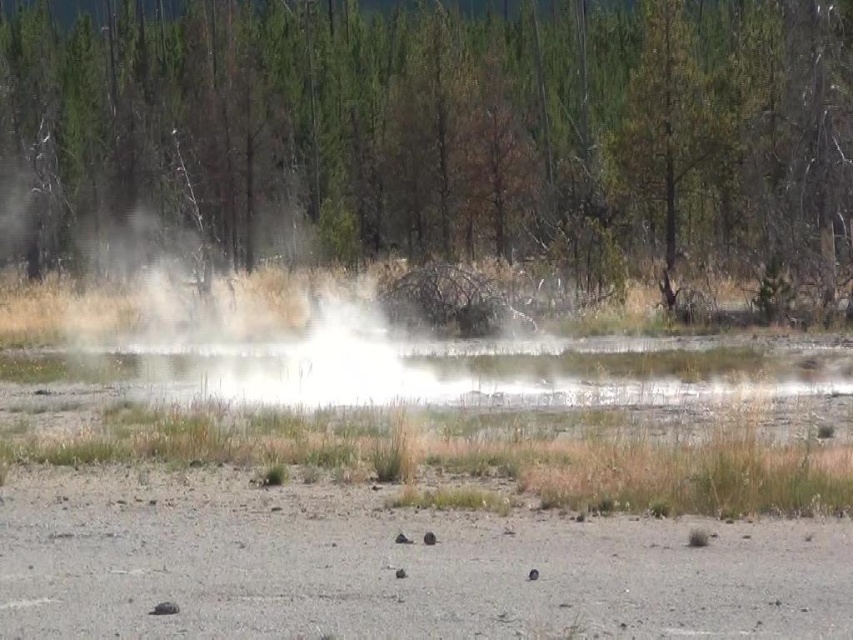
You are standing at the edge of the gravelly ground in the foreground of the image. You want to reach the green textured tree at center. Which direction should you walk to get there?

You should walk towards the center of the image to reach the green textured tree at center, which is located at point coordinates of (447,129).

You are standing in the geothermal area and want to avoid the steam to prevent getting wet. Which object should you move away from first? The green textured tree at center or the white steam at center?

You should move away from the white steam at center first because the green textured tree at center is positioned over it, meaning the steam is below the tree and closer to your current position.